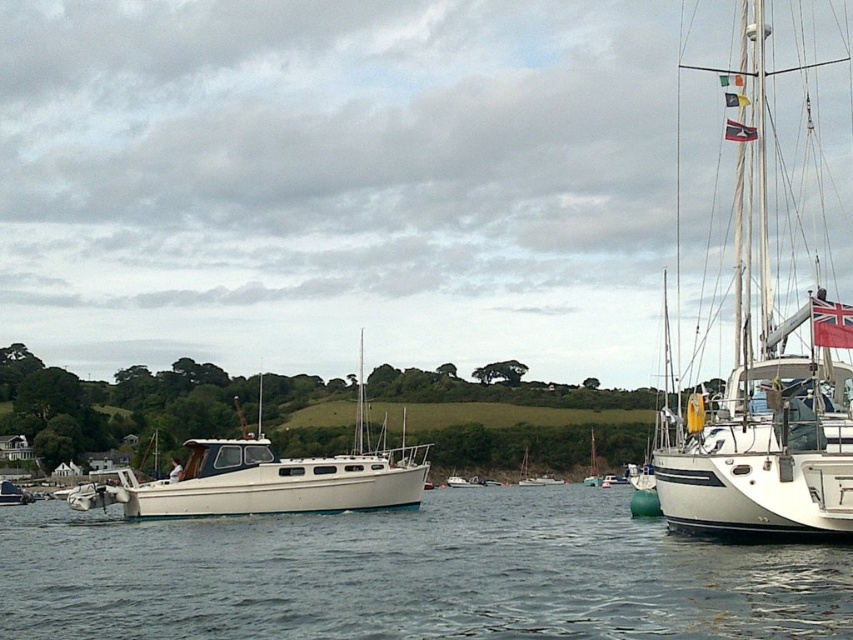
Question: Does white glossy sailboat at right have a greater width compared to white matte boat at center?

Choices:
 (A) no
 (B) yes

Answer: (B)

Question: Which point appears farthest from the camera in this image?

Choices:
 (A) (x=248, y=442)
 (B) (x=807, y=460)

Answer: (A)

Question: Which object appears farthest from the camera in this image?

Choices:
 (A) white matte boat at center
 (B) clear water at center

Answer: (A)

Question: Which point is closer to the camera taking this photo?

Choices:
 (A) (531, 540)
 (B) (231, 445)
 (C) (751, 348)

Answer: (C)

Question: Is clear water at center positioned at the back of white matte boat at center?

Choices:
 (A) no
 (B) yes

Answer: (A)

Question: Does white glossy sailboat at right have a greater width compared to white matte boat at center?

Choices:
 (A) yes
 (B) no

Answer: (A)